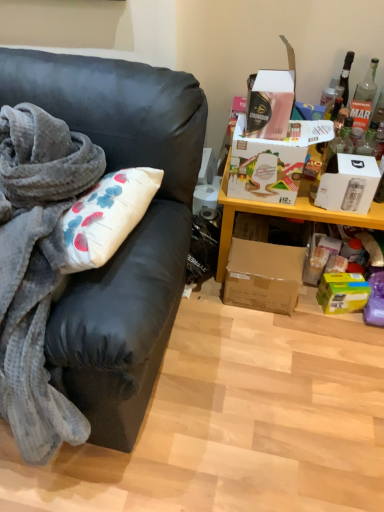
Question: Considering their positions, is matte black couch at left located in front of or behind white cardboard box at upper right, which is counted as the first box, starting from the top?

Choices:
 (A) behind
 (B) front

Answer: (B)

Question: Is matte black couch at left spatially inside white cardboard box at upper right, which is counted as the first box, starting from the top, or outside of it?

Choices:
 (A) outside
 (B) inside

Answer: (A)

Question: Considering the real-world distances, which object is farthest from the green matte box at lower right, which ranks as the 1th box in bottom-to-top order?

Choices:
 (A) white cardboard box at upper right, which is counted as the first box, starting from the top
 (B) white cardboard box at right, placed as the 2th box when sorted from top to bottom
 (C) yellow wood shelf at upper right
 (D) brown cardboard box at lower right, the third box when ordered from top to bottom
 (E) matte black couch at left

Answer: (E)

Question: Which object is the closest to the brown cardboard box at lower right, the third box when ordered from top to bottom?

Choices:
 (A) yellow wood shelf at upper right
 (B) white cardboard box at right, the 3th box in the bottom-to-top sequence
 (C) white cardboard box at upper right, which is counted as the first box, starting from the top
 (D) matte black couch at left
 (E) green matte box at lower right, which ranks as the 1th box in bottom-to-top order

Answer: (A)